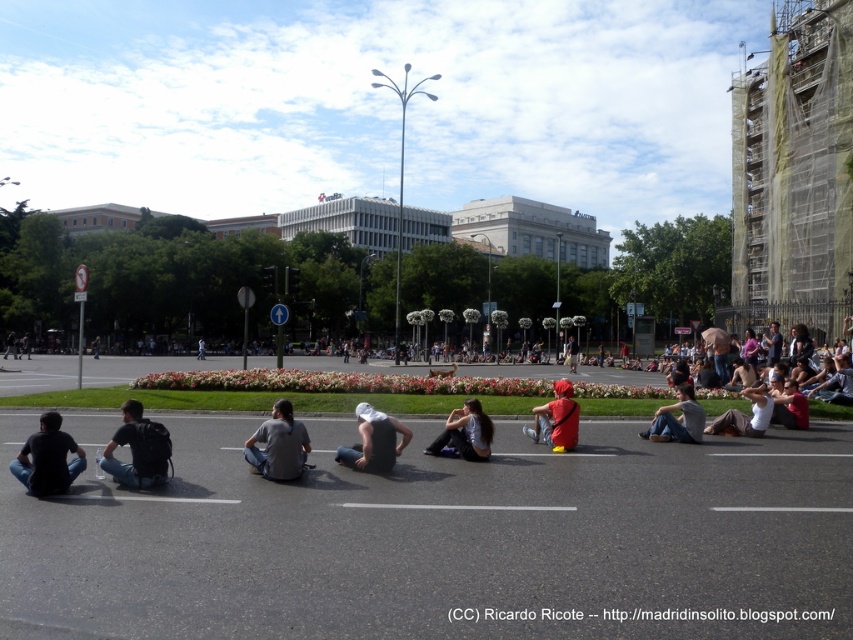
You are standing at the point with coordinates point (460, 426) and want to walk towards the point with coordinates point (283, 435). According to the scene description, will you be moving towards the flower bed or away from it?

The point (283, 435) is in front of point (460, 426), so moving towards it would mean moving towards the flower bed.

You are a photographer standing at the edge of the road in the urban scene. You want to take a photo of the dark gray fabric jacket at center while also including the vibrant flower bed in the background. Is the jacket positioned in a way that allows both elements to be captured in the same frame?

The dark gray fabric jacket at center is located at point (465, 433), which places it centrally within the scene. Since the flower bed is in the middle ground behind the people sitting on the road, the jacket and the flower bed can be captured together in the frame.

Consider the image. You are standing at the edge of the road in this urban scene. You want to retrieve the gray cotton shirt at center without crossing any traffic lanes. Can you reach it safely from your current position?

The gray cotton shirt at center and viewer are 9.00 meters apart from each other, so yes, you can safely reach the gray cotton shirt at center without crossing traffic lanes as the distance is manageable and the area is closed off for gatherings.